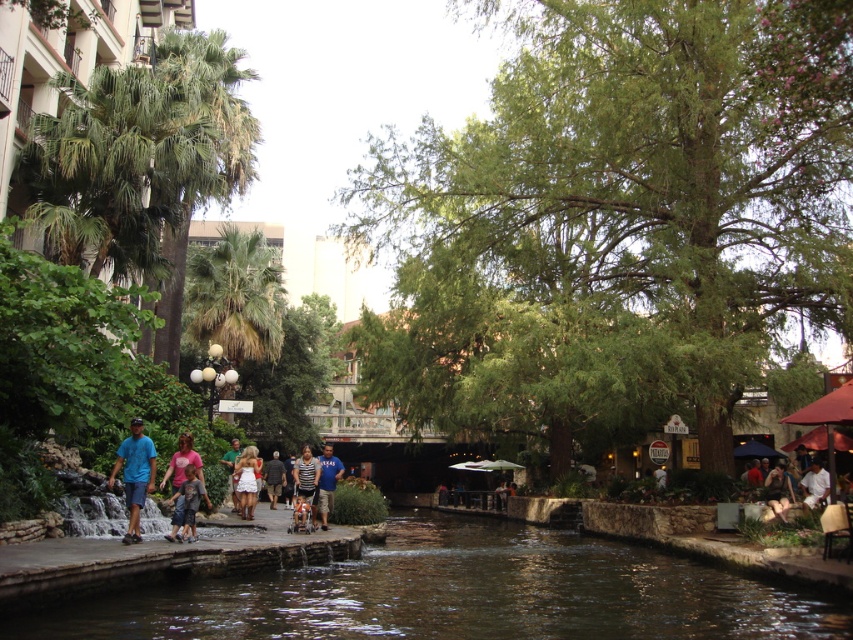
You are a photographer standing on the riverwalk and notice two items at the lower right corner of your viewfinder. The items are a dark brown leather jacket and a white cotton shirt. Since you want to capture both items in a single frame, can you estimate if the dark brown leather jacket at lower right will fit in the frame if the white cotton shirt at lower right already occupies most of the space?

The dark brown leather jacket at lower right has a smaller size compared to white cotton shirt at lower right, so it should fit in the frame alongside the white cotton shirt at lower right without issue.